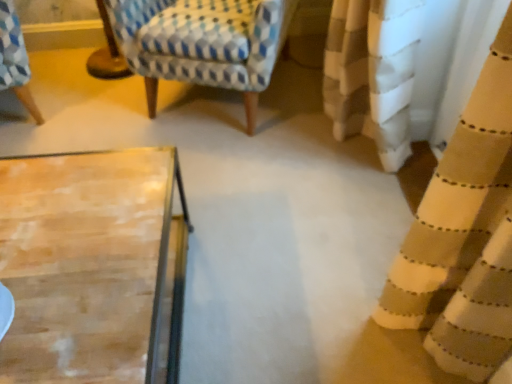
This screenshot has height=384, width=512. What are the coordinates of `free space in front of patterned fabric rocking chair at upper left` in the screenshot? It's located at click(263, 175).